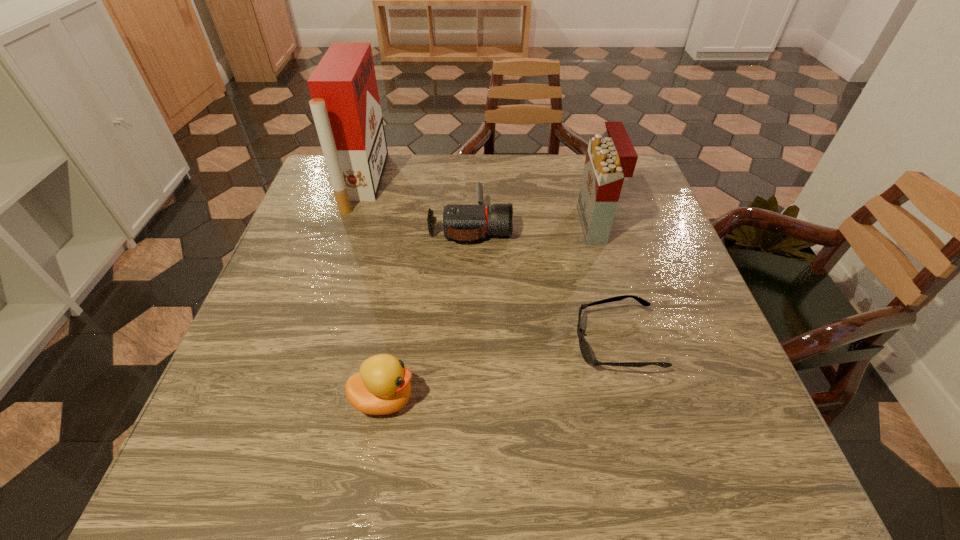
You are a GUI agent. You are given a task and a screenshot of the screen. Output one action in this format:
    pyautogui.click(x=<x>, y=<y>)
    Task: Click on the free space located 0.090m with the lid open on the right cigarette case
    This screenshot has width=960, height=540.
    Given the screenshot: What is the action you would take?
    pyautogui.click(x=546, y=225)

You are a GUI agent. You are given a task and a screenshot of the screen. Output one action in this format:
    pyautogui.click(x=<x>, y=<y>)
    Task: Click on the vacant area situated 0.180m with the lid open on the right cigarette case
    
    Given the screenshot: What is the action you would take?
    pyautogui.click(x=511, y=225)

This screenshot has width=960, height=540. I want to click on vacant space located with the lid open on the right cigarette case, so click(483, 225).

Locate an element on the screen. vacant space located 0.280m on the face of the third tallest object is located at coordinates (573, 399).

Locate an element on the screen. This screenshot has height=540, width=960. vacant space located on the lens of the fourth tallest object is located at coordinates (609, 225).

Identify the location of free spot located 0.290m on the lenses of the fourth farthest object. The height and width of the screenshot is (540, 960). (429, 342).

Locate an element on the screen. The height and width of the screenshot is (540, 960). free space located 0.400m on the lenses of the fourth farthest object is located at coordinates (373, 342).

Identify the location of free space located on the lenses of the fourth farthest object. (469, 342).

Image resolution: width=960 pixels, height=540 pixels. What are the coordinates of `object at the far edge` in the screenshot? It's located at (345, 104).

Locate an element on the screen. Image resolution: width=960 pixels, height=540 pixels. object situated at the left edge is located at coordinates (345, 104).